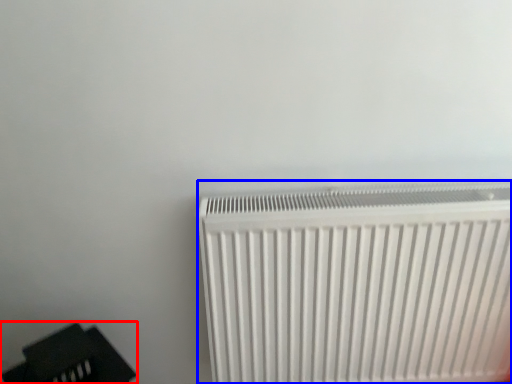
Question: Which object is closer to the camera taking this photo, furniture (highlighted by a red box) or radiator (highlighted by a blue box)?

Choices:
 (A) furniture
 (B) radiator

Answer: (A)